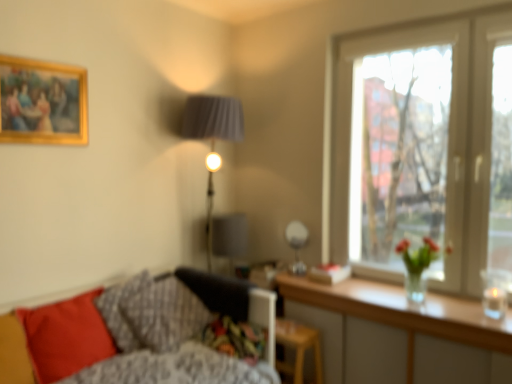
The height and width of the screenshot is (384, 512). Describe the element at coordinates (120, 311) in the screenshot. I see `textured gray pillow at lower left, the 2th pillow when ordered from left to right` at that location.

Measure the distance between point (460, 126) and camera.

7.60 feet.

Where is `wooden stool at lower center`? Image resolution: width=512 pixels, height=384 pixels. wooden stool at lower center is located at coordinates (298, 348).

Find the location of a particular element. The image size is (512, 384). translucent glass candle at lower right is located at coordinates click(x=495, y=291).

This screenshot has width=512, height=384. In order to click on gold-framed painting at upper left in this screenshot , I will do `click(42, 102)`.

Where is `clear wood table at lower right`? clear wood table at lower right is located at coordinates click(x=399, y=334).

The width and height of the screenshot is (512, 384). Find the location of `stool behind the transparent glass window at upper right`. stool behind the transparent glass window at upper right is located at coordinates (298, 348).

From the image's perspective, is wooden stool at lower center under transparent glass window at upper right?

Correct, wooden stool at lower center appears lower than transparent glass window at upper right in the image.

Is wooden stool at lower center far from transparent glass window at upper right?

Yes, wooden stool at lower center is far from transparent glass window at upper right.

Which is correct: wooden stool at lower center is inside transparent glass window at upper right, or outside of it?

wooden stool at lower center is not enclosed by transparent glass window at upper right.

Is translucent glass candle at lower right located outside wooden stool at lower center?

translucent glass candle at lower right lies outside wooden stool at lower center's area.

Which of these two, translucent glass candle at lower right or wooden stool at lower center, stands taller?

wooden stool at lower center is taller.

Which object is thinner, textured gray pillow at lower left, the 2th pillow when ordered from left to right, or wooden stool at lower center?

Thinner between the two is wooden stool at lower center.

From a real-world perspective, is textured gray pillow at lower left, the 2th pillow when ordered from left to right, physically above wooden stool at lower center?

Answer: Indeed, from a real-world perspective, textured gray pillow at lower left, the 2th pillow when ordered from left to right, stands above wooden stool at lower center.

Who is taller, textured gray pillow at lower left, the 2th pillow when ordered from left to right, or wooden stool at lower center?

textured gray pillow at lower left, the 2th pillow when ordered from left to right.

The image size is (512, 384). I want to click on stool below the textured gray pillow at lower left, which ranks as the second pillow in right-to-left order (from the image's perspective), so pos(298,348).

Is transparent glass window at upper right located outside gold-framed painting at upper left?

Yes, transparent glass window at upper right is not within gold-framed painting at upper left.

Measure the distance from transparent glass window at upper right to gold-framed painting at upper left.

A distance of 1.84 meters exists between transparent glass window at upper right and gold-framed painting at upper left.

Which of these two, transparent glass window at upper right or gold-framed painting at upper left, stands taller?

transparent glass window at upper right is taller.

Is clear wood table at lower right positioned behind textured gray pillow at lower left, the 2th pillow when ordered from left to right?

No, clear wood table at lower right is in front of textured gray pillow at lower left, the 2th pillow when ordered from left to right.

From a real-world perspective, which object stands above the other?

textured gray pillow at lower left, the 2th pillow when ordered from left to right, from a real-world perspective.

Is clear wood table at lower right surrounding textured gray pillow at lower left, which ranks as the second pillow in right-to-left order?

Definitely not — textured gray pillow at lower left, which ranks as the second pillow in right-to-left order, is not inside clear wood table at lower right.

How many degrees apart are the facing directions of clear wood table at lower right and textured gray pillow at lower left, the 2th pillow when ordered from left to right?

The angle between the facing direction of clear wood table at lower right and the facing direction of textured gray pillow at lower left, the 2th pillow when ordered from left to right, is 92.9 degrees.

Considering the positions of objects gold-framed painting at upper left and clear wood table at lower right in the image provided, who is behind, gold-framed painting at upper left or clear wood table at lower right?

gold-framed painting at upper left is more distant.

From the picture: Could you tell me if gold-framed painting at upper left is turned towards clear wood table at lower right?

No, gold-framed painting at upper left is not turned towards clear wood table at lower right.

From the image's perspective, is gold-framed painting at upper left positioned above or below clear wood table at lower right?

Clearly, from the image's perspective, gold-framed painting at upper left is above clear wood table at lower right.

How far apart are gold-framed painting at upper left and clear wood table at lower right?

→ gold-framed painting at upper left and clear wood table at lower right are 1.78 meters apart.

Is gold-framed painting at upper left oriented towards transparent glass window at upper right?

No, gold-framed painting at upper left does not turn towards transparent glass window at upper right.

Considering the relative sizes of gold-framed painting at upper left and transparent glass window at upper right in the image provided, is gold-framed painting at upper left shorter than transparent glass window at upper right?

Indeed, gold-framed painting at upper left has a lesser height compared to transparent glass window at upper right.

From a real-world perspective, between gold-framed painting at upper left and transparent glass window at upper right, who is vertically higher?

gold-framed painting at upper left is physically above.

What's the angular difference between gold-framed painting at upper left and transparent glass window at upper right's facing directions?

89.9 degrees separate the facing orientations of gold-framed painting at upper left and transparent glass window at upper right.

Image resolution: width=512 pixels, height=384 pixels. Find the location of `stool below the transparent glass window at upper right (from a real-world perspective)`. stool below the transparent glass window at upper right (from a real-world perspective) is located at coordinates (298, 348).

Where is `candle holder to the right of wooden stool at lower center`? Image resolution: width=512 pixels, height=384 pixels. candle holder to the right of wooden stool at lower center is located at coordinates (495, 291).

When comparing their distances from translucent glass candle at lower right, does textured gray pillow at lower left, which ranks as the second pillow in right-to-left order, or matte red pillow at lower left, which is the third pillow from right to left, seem closer?

Based on the image, textured gray pillow at lower left, which ranks as the second pillow in right-to-left order, appears to be nearer to translucent glass candle at lower right.

Estimate the real-world distances between objects in this image. Which object is closer to clear wood table at lower right, textured gray pillow at lower left, which ranks as the second pillow in right-to-left order, or matte red pillow at lower left, which is the third pillow from right to left?

textured gray pillow at lower left, which ranks as the second pillow in right-to-left order.

Consider the image. From the image, which object appears to be farther from wooden stool at lower center, gold-framed painting at upper left or transparent glass window at upper right?

The object further to wooden stool at lower center is gold-framed painting at upper left.

Looking at the image, which one is located closer to clear wood table at lower right, transparent glass window at upper right or gold-framed painting at upper left?

transparent glass window at upper right is closer to clear wood table at lower right.

Estimate the real-world distances between objects in this image. Which object is closer to textured gray pillow at lower left, the 2th pillow when ordered from left to right, clear wood table at lower right or fluffy gray pillow at lower left, the first pillow positioned from the right?

fluffy gray pillow at lower left, the first pillow positioned from the right, is closer to textured gray pillow at lower left, the 2th pillow when ordered from left to right.

When comparing their distances from textured gray pillow at lower left, which ranks as the second pillow in right-to-left order, does gold-framed painting at upper left or fluffy gray pillow at lower left, arranged as the third pillow when viewed from the left, seem closer?

Based on the image, fluffy gray pillow at lower left, arranged as the third pillow when viewed from the left, appears to be nearer to textured gray pillow at lower left, which ranks as the second pillow in right-to-left order.

Which object lies further to the anchor point translucent glass candle at lower right, wooden stool at lower center or fluffy gray pillow at lower left, the first pillow positioned from the right?

fluffy gray pillow at lower left, the first pillow positioned from the right, is positioned further to the anchor translucent glass candle at lower right.

When comparing their distances from gold-framed painting at upper left, does textured gray pillow at lower left, the 2th pillow when ordered from left to right, or transparent glass window at upper right seem further?

transparent glass window at upper right.

Identify the location of table between wooden stool at lower center and translucent glass candle at lower right. (399, 334).

What are the coordinates of `stool situated between gold-framed painting at upper left and transparent glass window at upper right from left to right` in the screenshot? It's located at (298, 348).

Identify the location of stool between fluffy gray pillow at lower left, arranged as the third pillow when viewed from the left, and clear wood table at lower right. (298, 348).

Locate an element on the screen. pillow located between textured gray pillow at lower left, the 2th pillow when ordered from left to right, and wooden stool at lower center in the left-right direction is located at coordinates (163, 314).